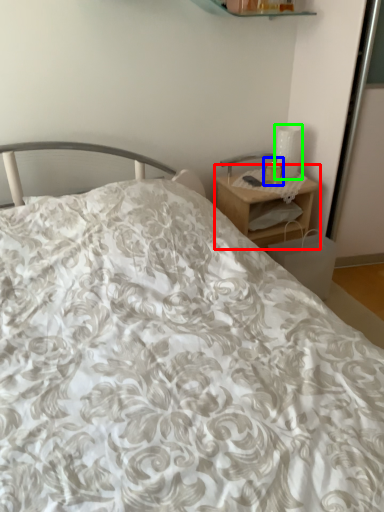
Question: Which object is the farthest from nightstand (highlighted by a red box)? Choose among these: candle holder (highlighted by a blue box) or table lamp (highlighted by a green box).

Choices:
 (A) candle holder
 (B) table lamp

Answer: (B)